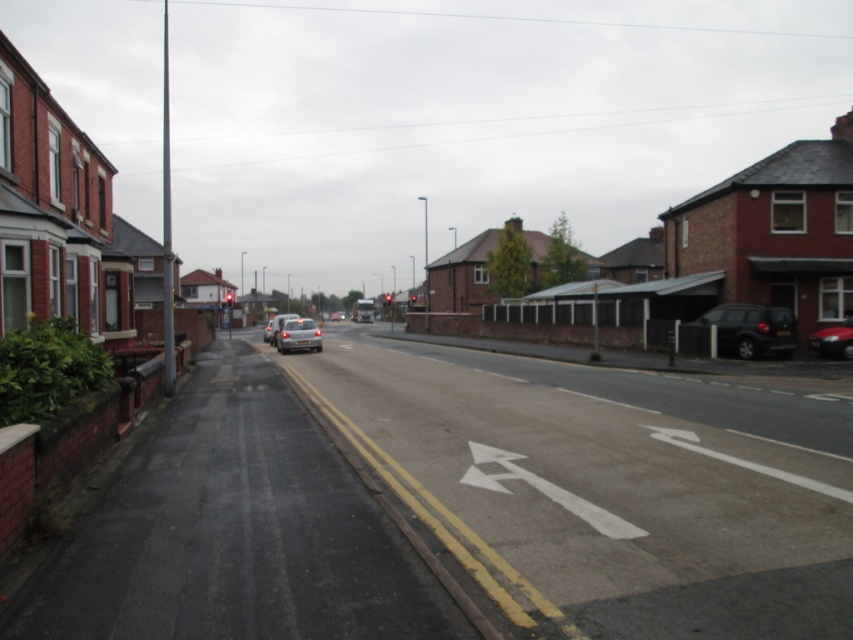
Who is positioned more to the right, smooth asphalt road at center or silver metallic car at center-left?

From the viewer's perspective, smooth asphalt road at center appears more on the right side.

Is point (724, 624) closer to camera compared to point (270, 323)?

Yes, point (724, 624) is in front of point (270, 323).

Is point (537, 456) positioned behind point (265, 339)?

No, it is not.

Locate an element on the screen. Image resolution: width=853 pixels, height=640 pixels. smooth asphalt road at center is located at coordinates (608, 486).

Which is below, smooth asphalt road at center or silver metallic car at center?

Positioned lower is smooth asphalt road at center.

Is smooth asphalt road at center positioned behind silver metallic car at center?

That is False.

Is point (677, 630) closer to camera compared to point (279, 337)?

Yes, point (677, 630) is in front of point (279, 337).

Identify the location of smooth asphalt road at center. The height and width of the screenshot is (640, 853). (608, 486).

Who is lower down, silver metallic car at center or silver metallic car at center-left?

silver metallic car at center is lower down.

Is silver metallic car at center smaller than silver metallic car at center-left?

Indeed, silver metallic car at center has a smaller size compared to silver metallic car at center-left.

Find the location of `silver metallic car at center`. silver metallic car at center is located at coordinates (299, 336).

I want to click on silver metallic car at center, so click(x=299, y=336).